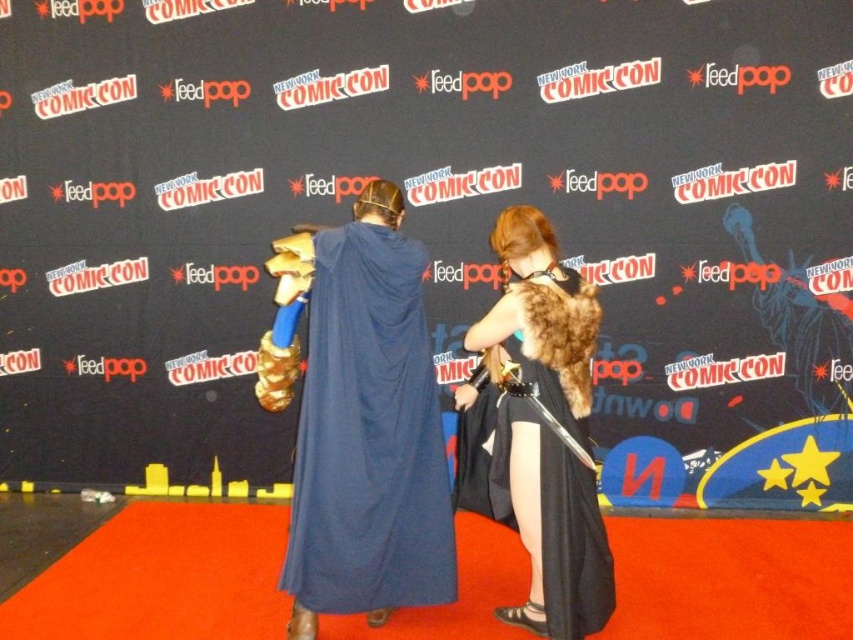
Question: Which of the following is the closest to the observer?

Choices:
 (A) blue drapery at center
 (B) fur-coated cape at center

Answer: (B)

Question: Observing the image, what is the correct spatial positioning of blue drapery at center in reference to fur-coated cape at center?

Choices:
 (A) left
 (B) right

Answer: (A)

Question: Which point is closer to the camera taking this photo?

Choices:
 (A) (583, 433)
 (B) (419, 401)

Answer: (A)

Question: Does blue drapery at center come in front of fur-coated cape at center?

Choices:
 (A) yes
 (B) no

Answer: (B)

Question: Is blue drapery at center wider than fur-coated cape at center?

Choices:
 (A) yes
 (B) no

Answer: (A)